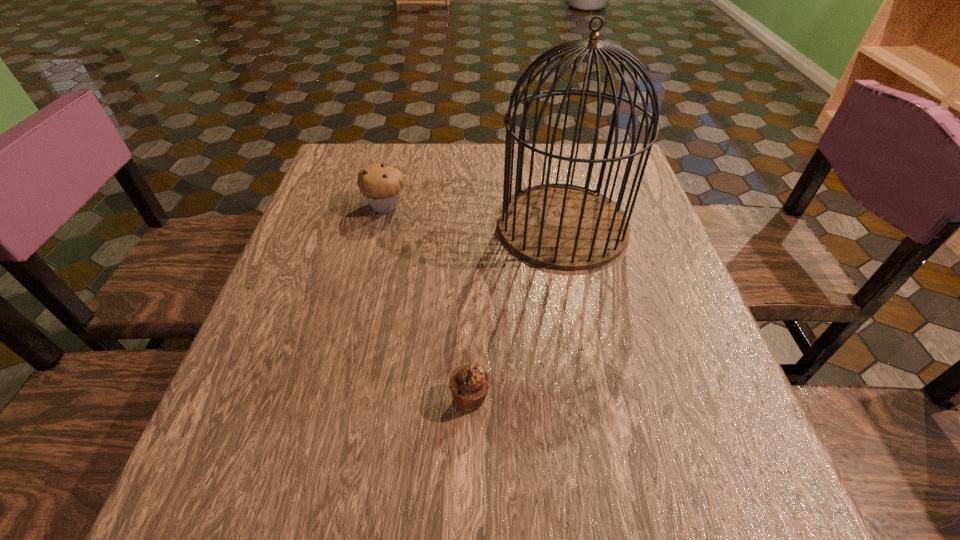
You are a GUI agent. You are given a task and a screenshot of the screen. Output one action in this format:
    pyautogui.click(x=<x>, y=<y>)
    Task: Click on the vacant region between the rightmost object and the leftmost object
    The width and height of the screenshot is (960, 540).
    Given the screenshot: What is the action you would take?
    pyautogui.click(x=474, y=215)

Identify which object is the second closest to the leftmost object. Please provide its 2D coordinates. Your answer should be formatted as a tuple, i.e. [(x, y)], where the tuple contains the x and y coordinates of a point satisfying the conditions above.

[(469, 384)]

Identify which object is located as the second nearest to the farther muffin. Please provide its 2D coordinates. Your answer should be formatted as a tuple, i.e. [(x, y)], where the tuple contains the x and y coordinates of a point satisfying the conditions above.

[(469, 384)]

You are a GUI agent. You are given a task and a screenshot of the screen. Output one action in this format:
    pyautogui.click(x=<x>, y=<y>)
    Task: Click on the vacant space that satisfies the following two spatial constraints: 1. on the front side of the leftmost object; 2. on the right side of the nearest object
    The image size is (960, 540).
    Given the screenshot: What is the action you would take?
    pyautogui.click(x=338, y=399)